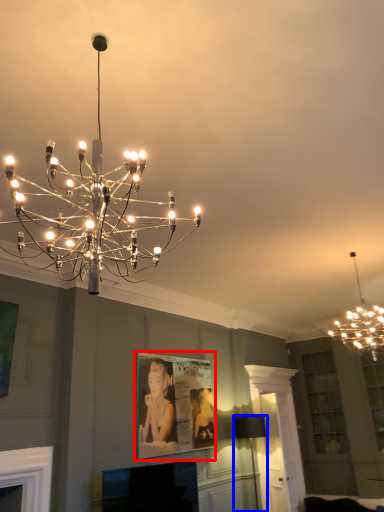
Question: Which object appears closest to the camera in this image, picture frame (highlighted by a red box) or lamp (highlighted by a blue box)?

Choices:
 (A) picture frame
 (B) lamp

Answer: (A)